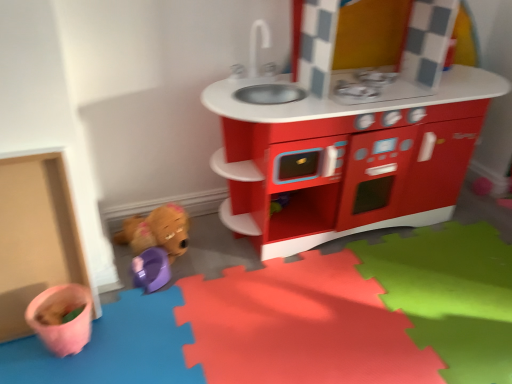
Question: From a real-world perspective, is brown plush toy at lower left, arranged as the second toy when ordered from the bottom, located beneath matte plastic play kitchen at center?

Choices:
 (A) no
 (B) yes

Answer: (B)

Question: Considering the relative sizes of brown plush toy at lower left, which is the first toy from top to bottom, and matte plastic play kitchen at center in the image provided, is brown plush toy at lower left, which is the first toy from top to bottom, shorter than matte plastic play kitchen at center?

Choices:
 (A) no
 (B) yes

Answer: (B)

Question: Can you confirm if brown plush toy at lower left, which is the first toy from top to bottom, is thinner than matte plastic play kitchen at center?

Choices:
 (A) no
 (B) yes

Answer: (B)

Question: Is brown plush toy at lower left, which is the first toy from top to bottom, oriented away from matte plastic play kitchen at center?

Choices:
 (A) yes
 (B) no

Answer: (B)

Question: Is the surface of brown plush toy at lower left, arranged as the second toy when ordered from the bottom, in direct contact with matte plastic play kitchen at center?

Choices:
 (A) no
 (B) yes

Answer: (A)

Question: From a real-world perspective, relative to purple plastic toy at lower left, which is counted as the second toy, starting from the top, is brown plush toy at lower left, arranged as the second toy when ordered from the bottom, vertically above or below?

Choices:
 (A) above
 (B) below

Answer: (A)

Question: Is brown plush toy at lower left, which is the first toy from top to bottom, taller or shorter than purple plastic toy at lower left, which is counted as the second toy, starting from the top?

Choices:
 (A) tall
 (B) short

Answer: (A)

Question: In terms of width, does brown plush toy at lower left, which is the first toy from top to bottom, look wider or thinner when compared to purple plastic toy at lower left, which is counted as the second toy, starting from the top?

Choices:
 (A) thin
 (B) wide

Answer: (B)

Question: From the image's perspective, relative to purple plastic toy at lower left, which ranks as the first toy in bottom-to-top order, is brown plush toy at lower left, arranged as the second toy when ordered from the bottom, above or below?

Choices:
 (A) below
 (B) above

Answer: (B)

Question: Is brown plush toy at lower left, arranged as the second toy when ordered from the bottom, situated inside matte plastic play kitchen at center or outside?

Choices:
 (A) inside
 (B) outside

Answer: (B)

Question: From a real-world perspective, is brown plush toy at lower left, arranged as the second toy when ordered from the bottom, positioned above or below matte plastic play kitchen at center?

Choices:
 (A) above
 (B) below

Answer: (B)

Question: Relative to matte plastic play kitchen at center, is brown plush toy at lower left, arranged as the second toy when ordered from the bottom, in front or behind?

Choices:
 (A) behind
 (B) front

Answer: (A)

Question: Is point (123, 238) positioned closer to the camera than point (298, 228)?

Choices:
 (A) closer
 (B) farther

Answer: (A)

Question: From a real-world perspective, is matte plastic play kitchen at center positioned above or below purple plastic toy at lower left, which ranks as the first toy in bottom-to-top order?

Choices:
 (A) above
 (B) below

Answer: (A)

Question: Does point (429, 221) appear closer or farther from the camera than point (137, 258)?

Choices:
 (A) closer
 (B) farther

Answer: (B)